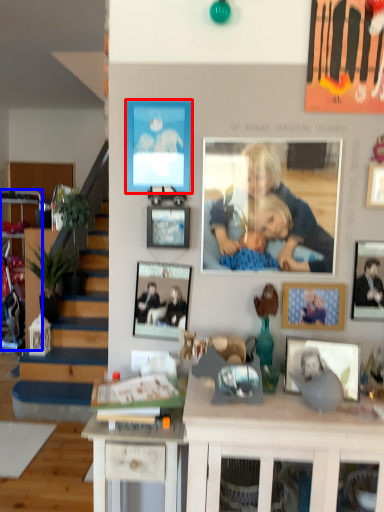
Question: Among these objects, which one is nearest to the camera, picture frame (highlighted by a red box) or cabinetry (highlighted by a blue box)?

Choices:
 (A) picture frame
 (B) cabinetry

Answer: (A)